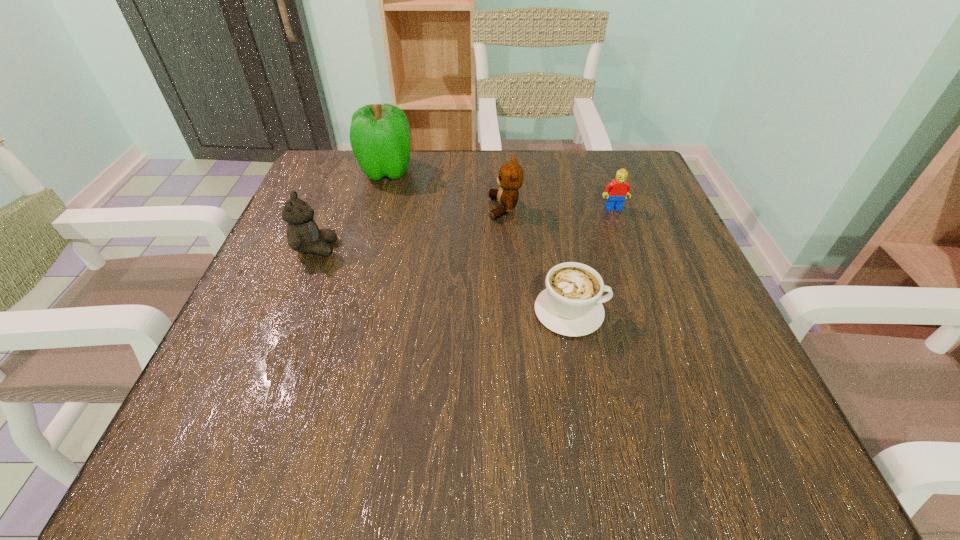
I want to click on vacant position at the far right corner of the desktop, so click(x=599, y=153).

You are a GUI agent. You are given a task and a screenshot of the screen. Output one action in this format:
    pyautogui.click(x=<x>, y=<y>)
    Task: Click on the vacant space at the near right corner of the desktop
    Image resolution: width=960 pixels, height=540 pixels.
    Given the screenshot: What is the action you would take?
    pyautogui.click(x=669, y=434)

The image size is (960, 540). In order to click on vacant area that lies between the second object from right to left and the third object from right to left in this screenshot , I will do `click(538, 260)`.

At what (x,y) coordinates should I click in order to perform the action: click on vacant space that is in between the left teddy bear and the fourth tallest object. Please return your answer as a coordinate pair (x, y). This screenshot has width=960, height=540. Looking at the image, I should click on (465, 228).

At what (x,y) coordinates should I click in order to perform the action: click on vacant point located between the third object from left to right and the tallest object. Please return your answer as a coordinate pair (x, y). The width and height of the screenshot is (960, 540). Looking at the image, I should click on pyautogui.click(x=445, y=190).

The width and height of the screenshot is (960, 540). Identify the location of free spot between the third object from right to left and the left teddy bear. (411, 228).

I want to click on vacant point located between the tallest object and the second nearest object, so click(x=351, y=209).

I want to click on free space between the nearer teddy bear and the shortest object, so click(x=444, y=279).

Find the location of a particular element. This screenshot has width=960, height=540. free space between the right teddy bear and the second nearest object is located at coordinates (411, 228).

Where is `free spot between the fourth object from left to right and the left teddy bear`? free spot between the fourth object from left to right and the left teddy bear is located at coordinates coord(444,279).